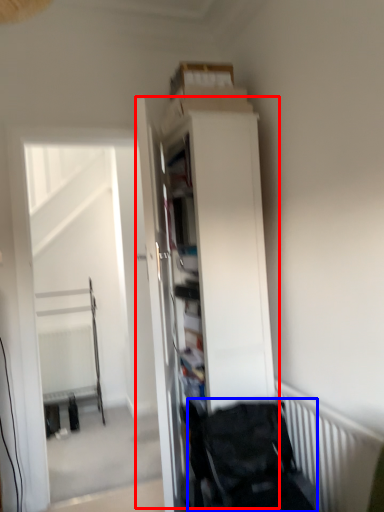
Question: Among these objects, which one is nearest to the camera, dresser (highlighted by a red box) or baby carriage (highlighted by a blue box)?

Choices:
 (A) dresser
 (B) baby carriage

Answer: (B)